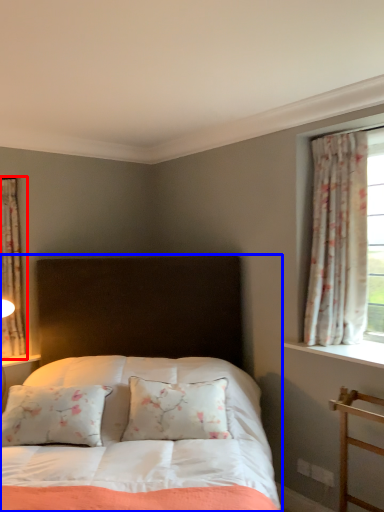
Question: Which of the following is the farthest to the observer, curtain (highlighted by a red box) or bed (highlighted by a blue box)?

Choices:
 (A) curtain
 (B) bed

Answer: (A)